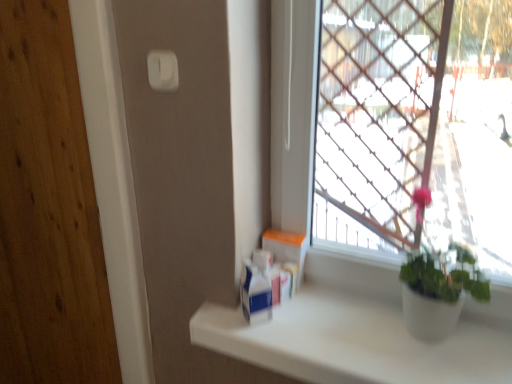
Question: Is white plastic light switch at upper center behind white matte counter top at lower right?

Choices:
 (A) yes
 (B) no

Answer: (A)

Question: From a real-world perspective, is white plastic light switch at upper center physically below white matte counter top at lower right?

Choices:
 (A) no
 (B) yes

Answer: (A)

Question: Is white plastic light switch at upper center facing towards white matte counter top at lower right?

Choices:
 (A) yes
 (B) no

Answer: (B)

Question: Is white plastic light switch at upper center touching white matte counter top at lower right?

Choices:
 (A) no
 (B) yes

Answer: (A)

Question: Is white plastic light switch at upper center positioned far away from white matte counter top at lower right?

Choices:
 (A) yes
 (B) no

Answer: (B)

Question: In the image, is white cardboard box at center positioned in front of or behind white plastic light switch at upper center?

Choices:
 (A) behind
 (B) front

Answer: (A)

Question: From a real-world perspective, relative to white plastic light switch at upper center, is white cardboard box at center vertically above or below?

Choices:
 (A) above
 (B) below

Answer: (B)

Question: From the image's perspective, is white cardboard box at center located above or below white plastic light switch at upper center?

Choices:
 (A) below
 (B) above

Answer: (A)

Question: Is white cardboard box at center to the left or to the right of white plastic light switch at upper center in the image?

Choices:
 (A) left
 (B) right

Answer: (B)

Question: Do you think white plastic container at center is within white plastic light switch at upper center, or outside of it?

Choices:
 (A) inside
 (B) outside

Answer: (B)

Question: From a real-world perspective, is white plastic container at center above or below white plastic light switch at upper center?

Choices:
 (A) below
 (B) above

Answer: (A)

Question: From the image's perspective, is white plastic container at center located above or below white plastic light switch at upper center?

Choices:
 (A) above
 (B) below

Answer: (B)

Question: Would you say white plastic container at center is to the left or to the right of white plastic light switch at upper center in the picture?

Choices:
 (A) left
 (B) right

Answer: (B)

Question: In terms of height, does white cardboard box at center look taller or shorter compared to white plastic container at center?

Choices:
 (A) tall
 (B) short

Answer: (A)

Question: Considering the relative positions of white cardboard box at center and white plastic container at center in the image provided, is white cardboard box at center to the left or to the right of white plastic container at center?

Choices:
 (A) right
 (B) left

Answer: (B)